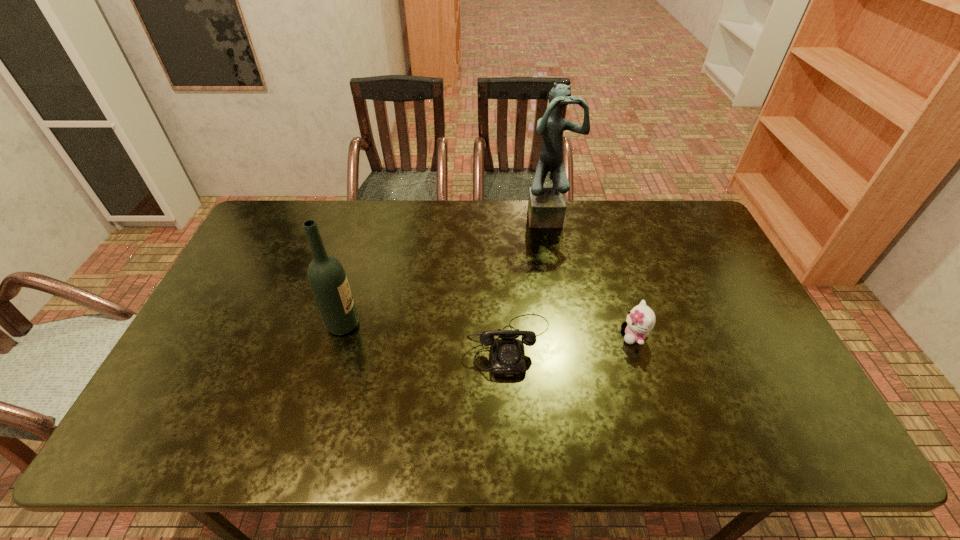
I want to click on the closest object to the leftmost object, so [507, 353].

At what (x,y) coordinates should I click in order to perform the action: click on free region that satisfies the following two spatial constraints: 1. on the face of the tallest object; 2. on the labeled side of the third shortest object. Please return your answer as a coordinate pair (x, y). This screenshot has height=540, width=960. Looking at the image, I should click on (569, 325).

Find the location of `free space in the image that satisfies the following two spatial constraints: 1. on the front-facing side of the rightmost object; 2. on the front-facing side of the telephone`. free space in the image that satisfies the following two spatial constraints: 1. on the front-facing side of the rightmost object; 2. on the front-facing side of the telephone is located at coordinates (636, 345).

Locate an element on the screen. The width and height of the screenshot is (960, 540). vacant region that satisfies the following two spatial constraints: 1. on the face of the farthest object; 2. on the labeled side of the third shortest object is located at coordinates (569, 325).

Identify the location of vacant space that satisfies the following two spatial constraints: 1. on the front-facing side of the second shortest object; 2. on the front-facing side of the telephone. This screenshot has width=960, height=540. (636, 345).